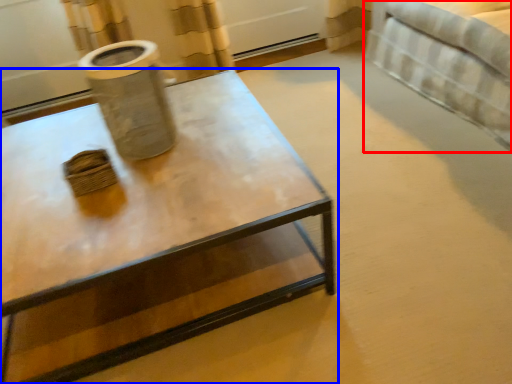
Question: Which point is further to the camera, bed (highlighted by a red box) or coffee table (highlighted by a blue box)?

Choices:
 (A) bed
 (B) coffee table

Answer: (A)